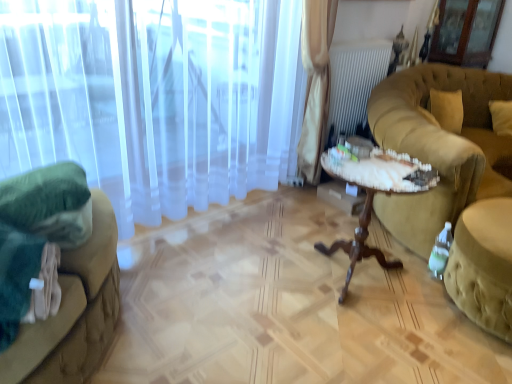
Question: Is transparent glass screen door at upper right positioned with its back to white sheer curtain at left?

Choices:
 (A) no
 (B) yes

Answer: (A)

Question: Does transparent glass screen door at upper right lie behind white sheer curtain at left?

Choices:
 (A) yes
 (B) no

Answer: (A)

Question: Is white sheer curtain at left a part of transparent glass screen door at upper right?

Choices:
 (A) yes
 (B) no

Answer: (B)

Question: Does transparent glass screen door at upper right have a lesser width compared to white sheer curtain at left?

Choices:
 (A) no
 (B) yes

Answer: (A)

Question: From a real-world perspective, is transparent glass screen door at upper right located beneath white sheer curtain at left?

Choices:
 (A) no
 (B) yes

Answer: (A)

Question: Is green fabric ottoman at lower right to the left or to the right of green fabric studio couch at left, positioned as the first studio couch in left-to-right order, in the image?

Choices:
 (A) left
 (B) right

Answer: (B)

Question: Which is correct: green fabric ottoman at lower right is inside green fabric studio couch at left, acting as the 2th studio couch starting from the right, or outside of it?

Choices:
 (A) inside
 (B) outside

Answer: (B)

Question: Considering their positions, is green fabric ottoman at lower right located in front of or behind green fabric studio couch at left, acting as the 2th studio couch starting from the right?

Choices:
 (A) front
 (B) behind

Answer: (B)

Question: Considering the positions of green fabric ottoman at lower right and green fabric studio couch at left, positioned as the first studio couch in left-to-right order, in the image, is green fabric ottoman at lower right taller or shorter than green fabric studio couch at left, positioned as the first studio couch in left-to-right order,?

Choices:
 (A) tall
 (B) short

Answer: (B)

Question: From a real-world perspective, is woodenwoodentable at right physically located above or below transparent glass screen door at upper right?

Choices:
 (A) below
 (B) above

Answer: (A)

Question: Would you say woodenwoodentable at right is to the left or to the right of transparent glass screen door at upper right in the picture?

Choices:
 (A) left
 (B) right

Answer: (A)

Question: Based on their sizes in the image, would you say woodenwoodentable at right is bigger or smaller than transparent glass screen door at upper right?

Choices:
 (A) small
 (B) big

Answer: (B)

Question: Relative to transparent glass screen door at upper right, is woodenwoodentable at right in front or behind?

Choices:
 (A) behind
 (B) front

Answer: (B)

Question: Considering the relative positions of transparent glass screen door at upper right and green fabric ottoman at lower right in the image provided, is transparent glass screen door at upper right to the left or to the right of green fabric ottoman at lower right?

Choices:
 (A) left
 (B) right

Answer: (B)

Question: Considering the positions of transparent glass screen door at upper right and green fabric ottoman at lower right in the image, is transparent glass screen door at upper right wider or thinner than green fabric ottoman at lower right?

Choices:
 (A) wide
 (B) thin

Answer: (B)